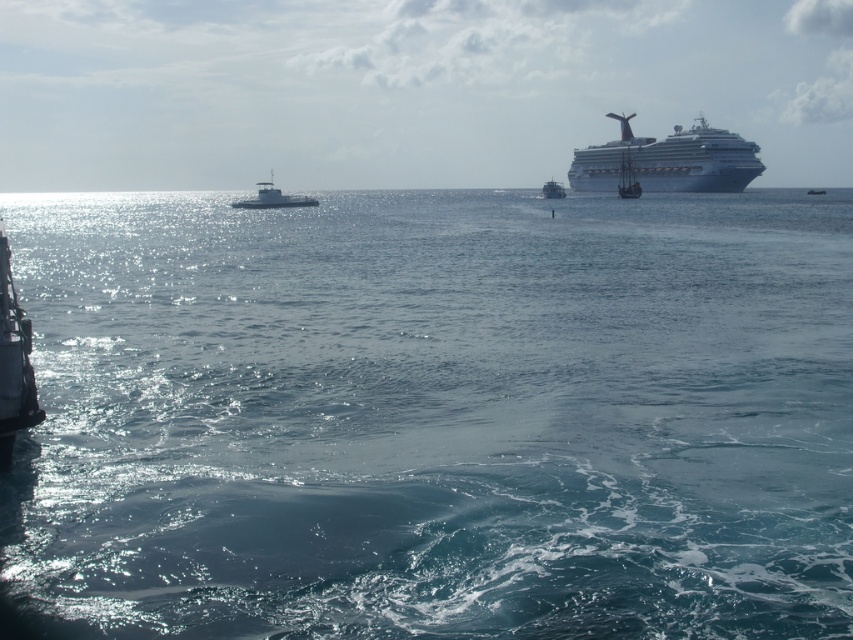
Who is positioned more to the left, blue water at center or white glossy sailboat at center?

Positioned to the left is blue water at center.

Is blue water at center bigger than white glossy sailboat at center?

Yes.

Find the location of a particular element. The image size is (853, 640). blue water at center is located at coordinates (434, 416).

Is white glossy sailboat at center to the right of metallic gray boat at center from the viewer's perspective?

Incorrect, white glossy sailboat at center is not on the right side of metallic gray boat at center.

Based on the photo, between white glossy sailboat at center and metallic gray boat at center, which one has less height?

Standing shorter between the two is white glossy sailboat at center.

Locate an element on the screen. The height and width of the screenshot is (640, 853). white glossy sailboat at center is located at coordinates (553, 189).

Can you confirm if white glossy cruise ship at upper right is wider than white glossy sailboat at center?

Yes, white glossy cruise ship at upper right is wider than white glossy sailboat at center.

Locate an element on the screen. white glossy cruise ship at upper right is located at coordinates pyautogui.click(x=668, y=161).

Is point (698, 170) closer to camera compared to point (553, 182)?

Yes, it is.

The height and width of the screenshot is (640, 853). What are the coordinates of `white glossy cruise ship at upper right` in the screenshot? It's located at (668, 161).